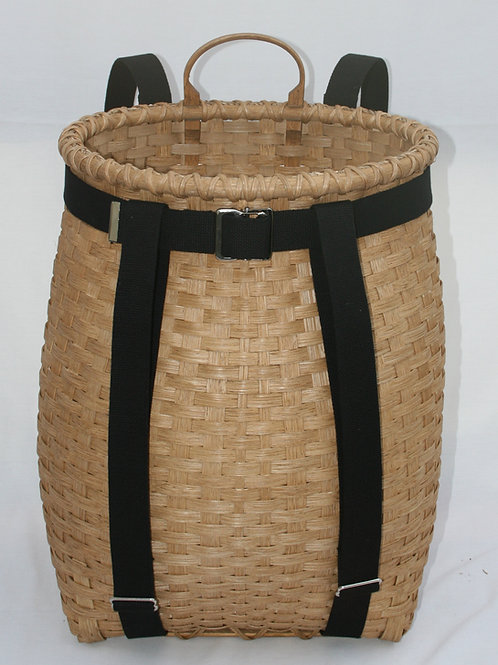
Where is `space right of basket`? space right of basket is located at coordinates (480, 384).